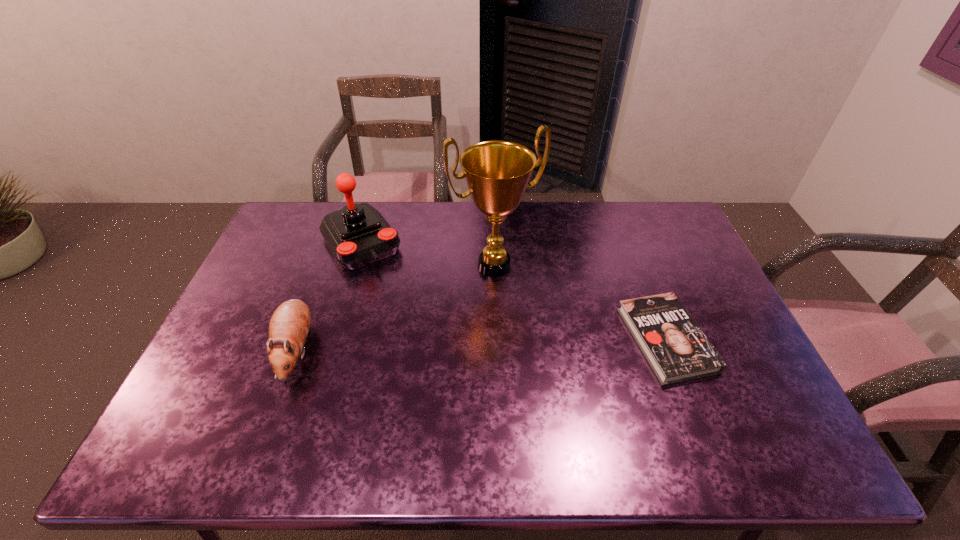
Locate an element on the screen. This screenshot has height=540, width=960. the third tallest object is located at coordinates (289, 325).

Where is `the rightmost object`? This screenshot has height=540, width=960. the rightmost object is located at coordinates (677, 350).

Find the location of `book`. book is located at coordinates (677, 350).

Where is `joystick`? This screenshot has width=960, height=540. joystick is located at coordinates 358,235.

Find the location of a particular element. The width and height of the screenshot is (960, 540). award is located at coordinates (497, 173).

Find the location of a particular element. the tallest object is located at coordinates (497, 173).

The image size is (960, 540). What are the coordinates of `vacant space situated at the face of the hamster` in the screenshot? It's located at (273, 415).

Where is `vacant region located on the back of the rightmost object`? vacant region located on the back of the rightmost object is located at coordinates (628, 240).

Identify the location of free space located 0.300m on the base of the joystick. This screenshot has width=960, height=540. (417, 329).

You are a GUI agent. You are given a task and a screenshot of the screen. Output one action in this format:
    pyautogui.click(x=<x>, y=<y>)
    Task: Click on the blank area located on the base of the joystick
    This screenshot has height=540, width=960.
    Given the screenshot: What is the action you would take?
    pyautogui.click(x=413, y=324)